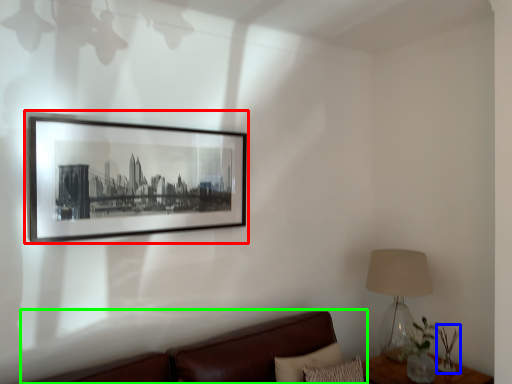
Question: Which object is positioned farthest from picture frame (highlighted by a red box)? Select from plant (highlighted by a blue box) and studio couch (highlighted by a green box).

Choices:
 (A) plant
 (B) studio couch

Answer: (A)